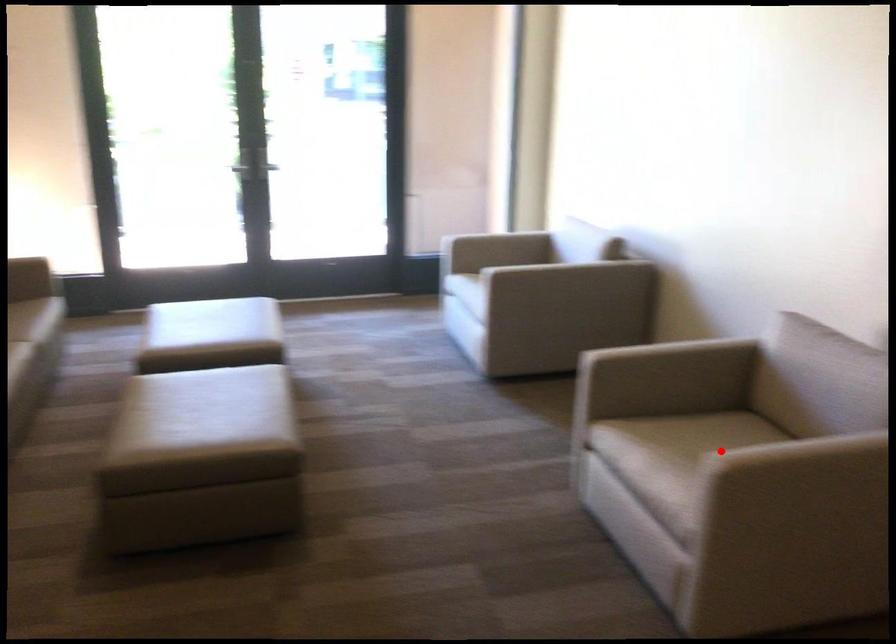
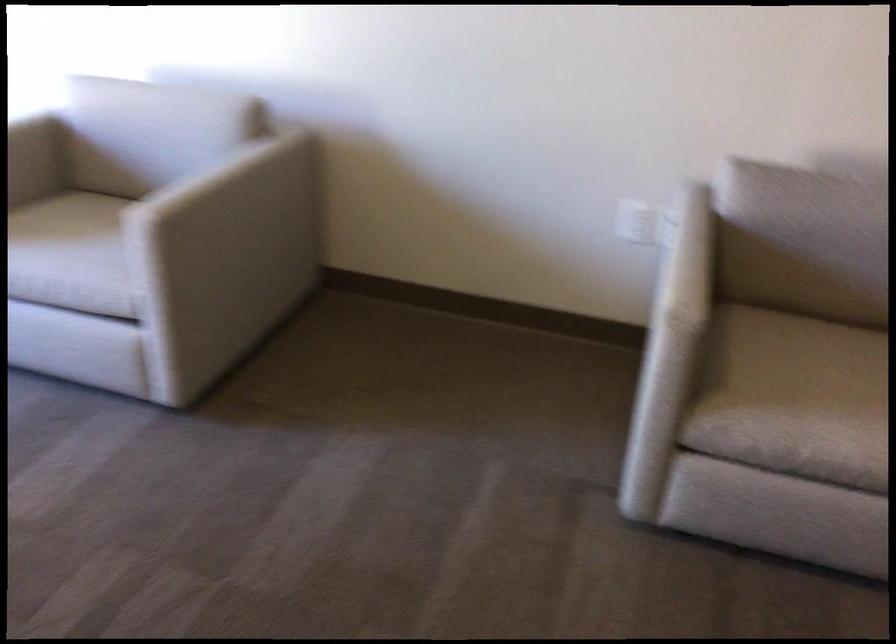
Question: I am providing you with two images of the same scene from different viewpoints. A red point is shown in image1. For the corresponding object point in image2, is it positioned nearer or farther from the camera?

Choices:
 (A) Nearer
 (B) Farther

Answer: (A)